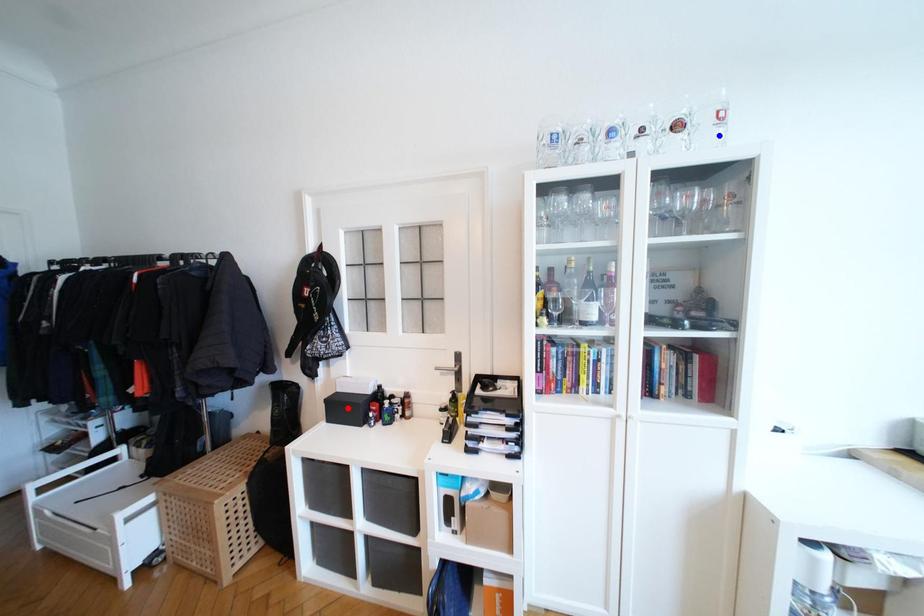
Question: In the image, two points are highlighted. Which point is nearer to the camera? Reply with the corresponding letter.

Choices:
 (A) blue point
 (B) red point

Answer: (A)